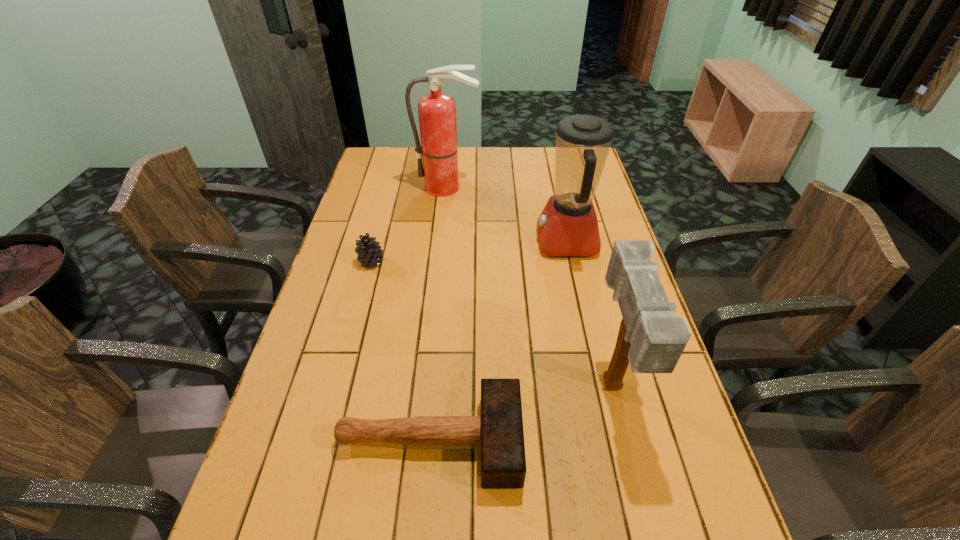
Image resolution: width=960 pixels, height=540 pixels. Identify the location of fire extinguisher. (437, 111).

Where is `blender`? blender is located at coordinates (568, 226).

At what (x,y) coordinates should I click in order to perform the action: click on the third shortest object. Please return your answer as a coordinate pair (x, y). Looking at the image, I should click on (651, 338).

Identify the location of the taller mallet. (651, 338).

Locate an element on the screen. The image size is (960, 540). pinecone is located at coordinates (369, 252).

Locate an element on the screen. the left mallet is located at coordinates (499, 431).

Locate an element on the screen. the shorter mallet is located at coordinates (499, 431).

In order to click on vacant space situated with the handle and hose on the farthest object in this screenshot , I will do `click(443, 232)`.

Where is `free point located on the front of the blender near the controls`? The height and width of the screenshot is (540, 960). free point located on the front of the blender near the controls is located at coordinates (472, 241).

Locate an element on the screen. This screenshot has width=960, height=540. free location located on the front of the blender near the controls is located at coordinates (418, 241).